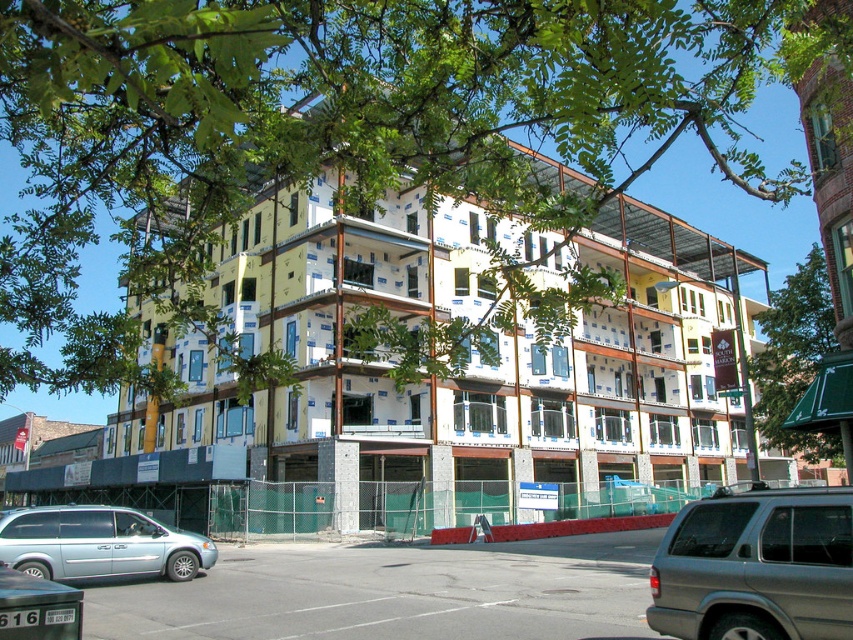
You are a delivery driver who needs to park your vehicle between the matte silver minivan at lower left and the green leafy tree at upper center. Considering their heights, can your 2.1 meter tall truck fit in the space without hitting anything?

The matte silver minivan at lower left is shorter than the green leafy tree at upper center. Since the truck is 2.1 meters tall, it depends on the minimum height clearance between the minivan and the tree. However, since the minivan is shorter than the tree, there might be enough vertical space if the truck stays between them. But without exact measurements, it is uncertain. The safest answer is no, unless the clearance is confirmed to be above 2.1 meters.